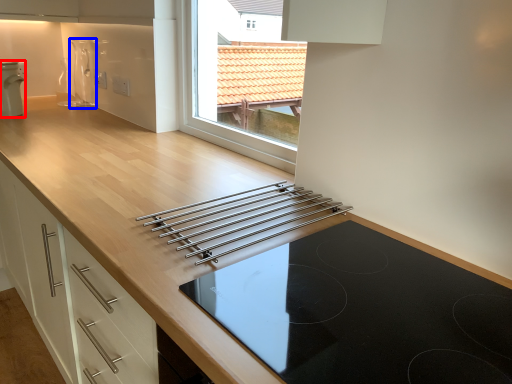
Question: Which point is closer to the camera, home appliance (highlighted by a red box) or appliance (highlighted by a blue box)?

Choices:
 (A) home appliance
 (B) appliance

Answer: (A)